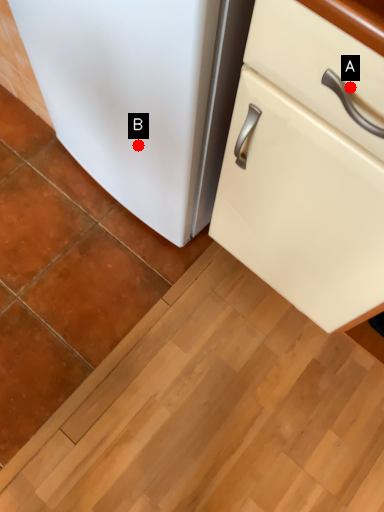
Question: Two points are circled on the image, labeled by A and B beside each circle. Which point appears closest to the camera in this image?

Choices:
 (A) A is closer
 (B) B is closer

Answer: (A)